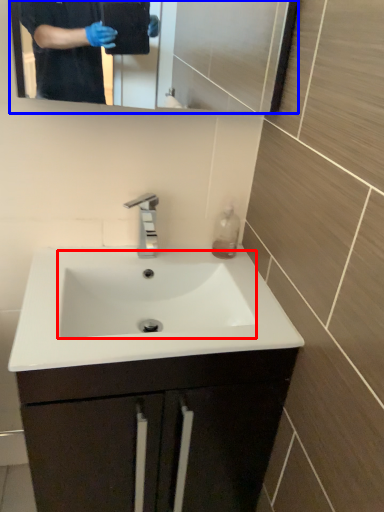
Question: Among these objects, which one is farthest to the camera, sink (highlighted by a red box) or mirror (highlighted by a blue box)?

Choices:
 (A) sink
 (B) mirror

Answer: (A)